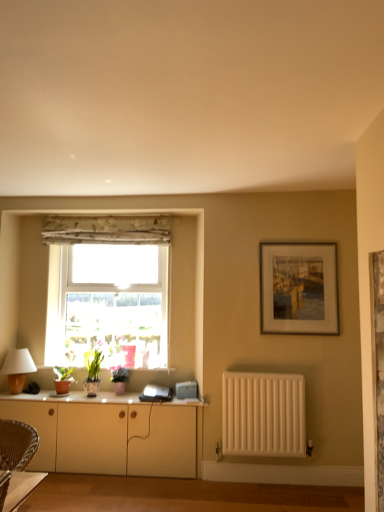
Identify the location of free space above floral fabric curtain at upper center (from a real-world perspective). Image resolution: width=384 pixels, height=512 pixels. (118, 227).